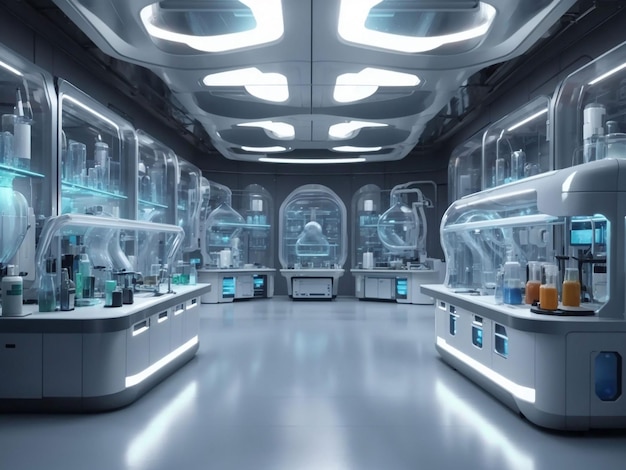
Where is `wall`? Image resolution: width=626 pixels, height=470 pixels. wall is located at coordinates (39, 49).